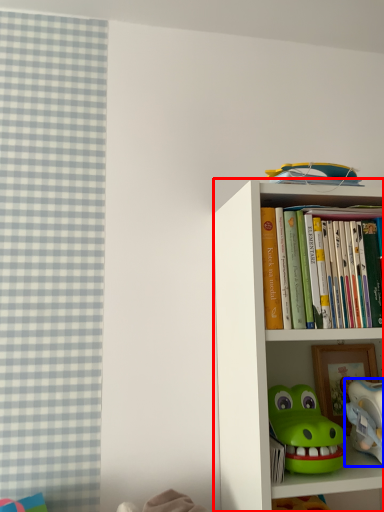
Question: Which of the following is the farthest to the observer, bookcase (highlighted by a red box) or toy (highlighted by a blue box)?

Choices:
 (A) bookcase
 (B) toy

Answer: (B)